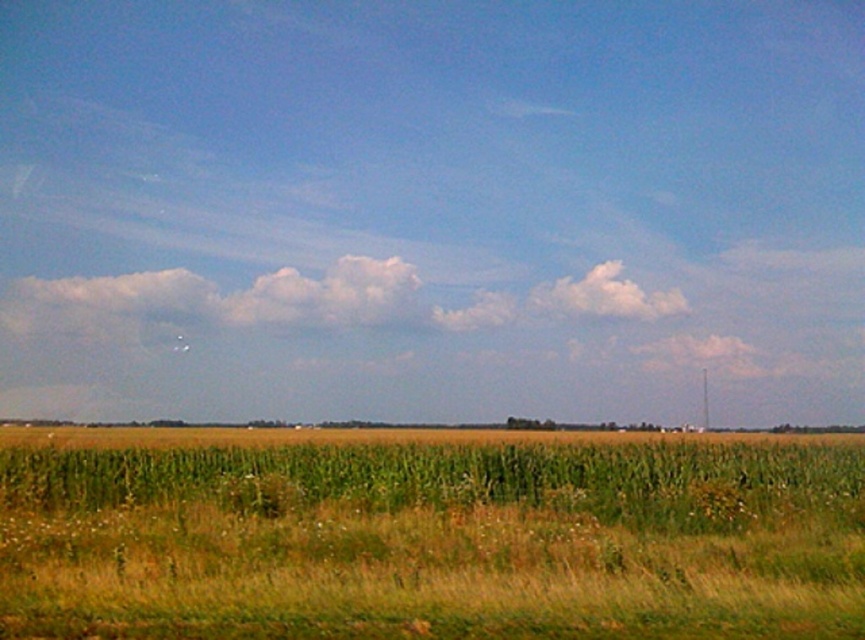
Does white fluffy cloud at center come behind white fluffy cloud at upper center?

No.

Is point (370, 262) closer to camera compared to point (596, 280)?

Yes.

Does point (293, 268) come in front of point (593, 289)?

Yes, point (293, 268) is in front of point (593, 289).

Where is `white fluffy cloud at center`? The height and width of the screenshot is (640, 865). white fluffy cloud at center is located at coordinates (327, 294).

Is green grassy wheat field at center closer to the viewer compared to white fluffy cloud at center?

Yes, green grassy wheat field at center is in front of white fluffy cloud at center.

Looking at this image, which is more to the left, green grassy wheat field at center or white fluffy cloud at center?

white fluffy cloud at center

Identify the location of green grassy wheat field at center. (428, 536).

Locate an element on the screen. green grassy wheat field at center is located at coordinates (428, 536).

Can you confirm if green grassy wheat field at center is smaller than white fluffy cloud at upper center?

No, green grassy wheat field at center is not smaller than white fluffy cloud at upper center.

Looking at this image, who is shorter, green grassy wheat field at center or white fluffy cloud at upper center?

white fluffy cloud at upper center is shorter.

Identify the location of green grassy wheat field at center. Image resolution: width=865 pixels, height=640 pixels. (428, 536).